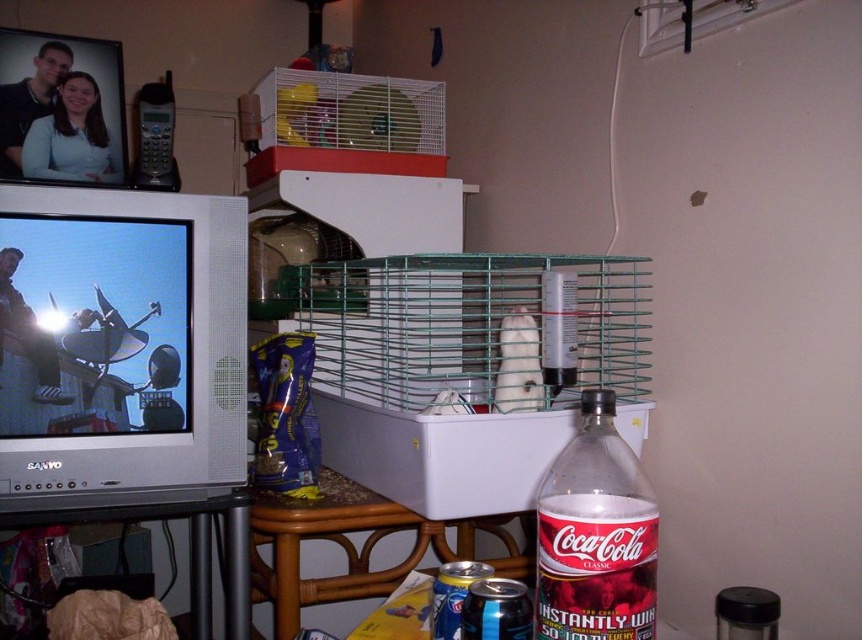
Does green wire birdcage at upper center appear on the right side of rattan table at lower center?

Incorrect, green wire birdcage at upper center is not on the right side of rattan table at lower center.

Is green wire birdcage at upper center positioned before rattan table at lower center?

No, it is behind rattan table at lower center.

Is point (283, 74) less distant than point (465, 531)?

Yes, it is.

You are a GUI agent. You are given a task and a screenshot of the screen. Output one action in this format:
    pyautogui.click(x=<x>, y=<y>)
    Task: Click on the green wire birdcage at upper center
    
    Given the screenshot: What is the action you would take?
    [x=342, y=124]

Consider the image. Can you confirm if green wire birdcage at upper center is smaller than wooden table at lower left?

Yes.

Is green wire birdcage at upper center positioned before wooden table at lower left?

No, it is behind wooden table at lower left.

Locate an element on the screen. This screenshot has width=862, height=640. green wire birdcage at upper center is located at coordinates (342, 124).

You are a GUI agent. You are given a task and a screenshot of the screen. Output one action in this format:
    pyautogui.click(x=<x>, y=<y>)
    Task: Click on the green wire birdcage at upper center
    
    Given the screenshot: What is the action you would take?
    [342, 124]

Which is in front, point (303, 600) or point (244, 556)?

Point (244, 556) is in front.

Does point (272, 500) come closer to viewer compared to point (225, 618)?

Yes, point (272, 500) is in front of point (225, 618).

Find the location of a particular element. rattan table at lower center is located at coordinates (355, 547).